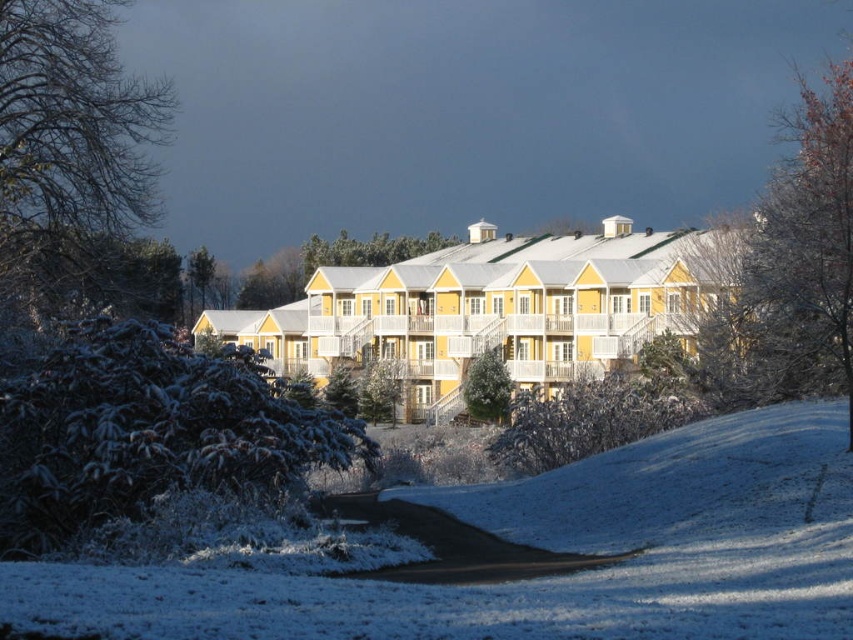
Question: Is bare branches at upper right bigger than green textured pine tree at upper left?

Choices:
 (A) no
 (B) yes

Answer: (B)

Question: Does bare branches at upper right appear over green textured pine tree at upper left?

Choices:
 (A) yes
 (B) no

Answer: (A)

Question: Estimate the real-world distances between objects in this image. Which object is closer to the green textured pine tree at center?

Choices:
 (A) bare branches at left
 (B) bare branches at upper right

Answer: (B)

Question: Among these points, which one is farthest from the camera?

Choices:
 (A) [x=137, y=221]
 (B) [x=242, y=474]
 (C) [x=498, y=355]

Answer: (C)

Question: Which object is farther from the camera taking this photo?

Choices:
 (A) bare branches at left
 (B) bare branches at upper right
 (C) frosted pine tree at lower left

Answer: (A)

Question: Where is green textured pine tree at center located in relation to green textured pine tree at upper left in the image?

Choices:
 (A) left
 (B) right

Answer: (B)